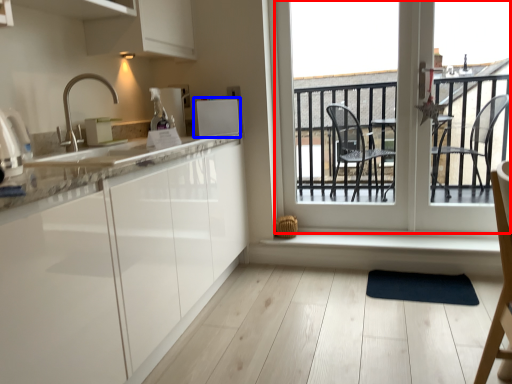
Question: Among these objects, which one is nearest to the camera, window (highlighted by a red box) or appliance (highlighted by a blue box)?

Choices:
 (A) window
 (B) appliance

Answer: (A)